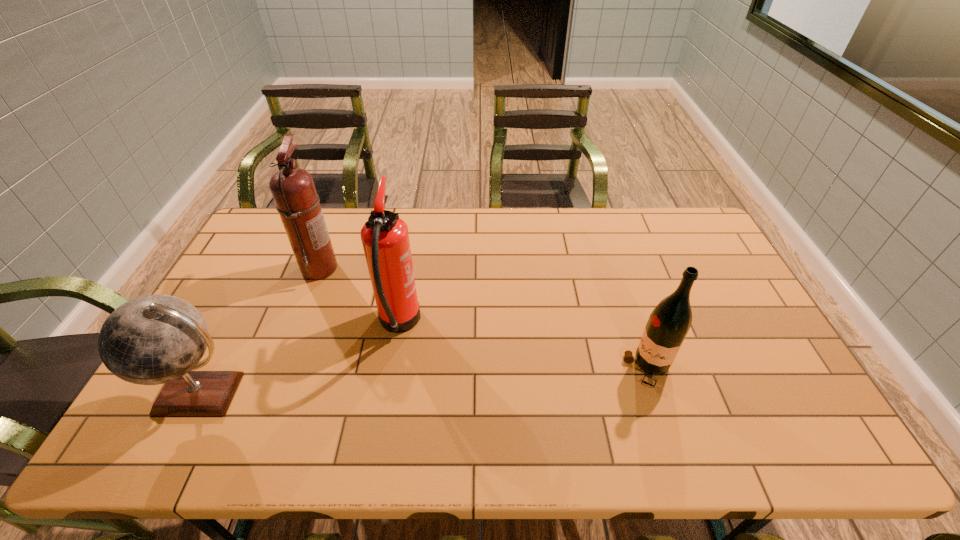
I want to click on the farthest object, so click(x=293, y=190).

Where is `the left fire extinguisher`? The height and width of the screenshot is (540, 960). the left fire extinguisher is located at coordinates (293, 190).

Image resolution: width=960 pixels, height=540 pixels. I want to click on the right fire extinguisher, so click(385, 238).

Where is `the nearer fire extinguisher`? The width and height of the screenshot is (960, 540). the nearer fire extinguisher is located at coordinates (385, 238).

Locate an element on the screen. wine bottle is located at coordinates (668, 324).

This screenshot has height=540, width=960. I want to click on the leftmost object, so click(x=154, y=339).

This screenshot has width=960, height=540. Identify the location of vacant region located on the front-facing side of the left fire extinguisher. (402, 267).

At what (x,y) coordinates should I click in order to perform the action: click on vacant space located at the nozzle of the right fire extinguisher. Please return your answer as a coordinate pair (x, y). The height and width of the screenshot is (540, 960). Looking at the image, I should click on (492, 325).

Where is `vacant space located 0.150m on the back of the rightmost object`? vacant space located 0.150m on the back of the rightmost object is located at coordinates (628, 308).

Locate an element on the screen. Image resolution: width=960 pixels, height=540 pixels. free region located at the equator of the leftmost object is located at coordinates (173, 451).